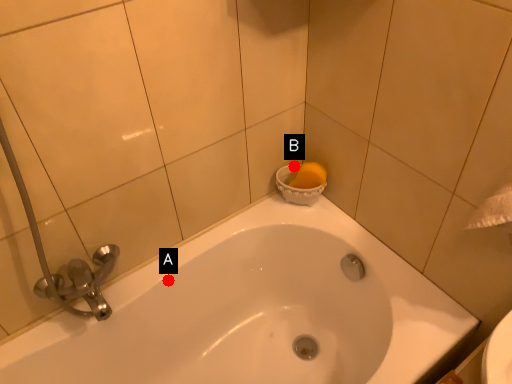
Question: Two points are circled on the image, labeled by A and B beside each circle. Which point appears closest to the camera in this image?

Choices:
 (A) A is closer
 (B) B is closer

Answer: (A)